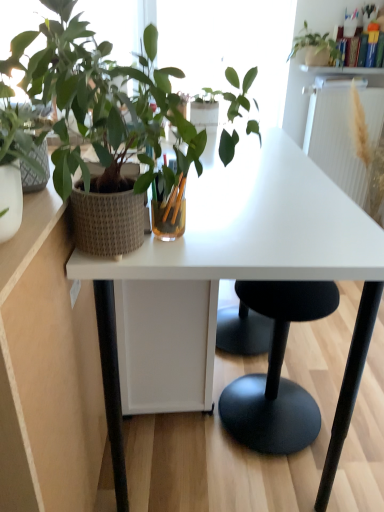
Question: Does textured woven pot at left, arranged as the 1th houseplant when viewed from the front, have a lesser height compared to white glossy shelf at upper center?

Choices:
 (A) no
 (B) yes

Answer: (A)

Question: From a real-world perspective, is textured woven pot at left, placed as the 1th houseplant when sorted from left to right, located higher than white glossy shelf at upper center?

Choices:
 (A) no
 (B) yes

Answer: (B)

Question: Does textured woven pot at left, the 1th houseplant when ordered from bottom to top, appear on the right side of white glossy shelf at upper center?

Choices:
 (A) no
 (B) yes

Answer: (A)

Question: Can you confirm if textured woven pot at left, the 1th houseplant when ordered from bottom to top, is wider than white glossy shelf at upper center?

Choices:
 (A) no
 (B) yes

Answer: (B)

Question: Is the depth of textured woven pot at left, the 1th houseplant when ordered from bottom to top, greater than that of white glossy shelf at upper center?

Choices:
 (A) yes
 (B) no

Answer: (B)

Question: Does textured woven pot at left, which is the 2th houseplant from right to left, have a smaller size compared to white glossy shelf at upper center?

Choices:
 (A) no
 (B) yes

Answer: (A)

Question: Is white textured radiator at upper right behind matte white pot at upper right, which is counted as the second houseplant, starting from the bottom?

Choices:
 (A) no
 (B) yes

Answer: (A)

Question: From a real-world perspective, is white textured radiator at upper right over matte white pot at upper right, marked as the 1th houseplant in a back-to-front arrangement?

Choices:
 (A) yes
 (B) no

Answer: (B)

Question: Does white textured radiator at upper right have a greater width compared to matte white pot at upper right, which ranks as the 2th houseplant in left-to-right order?

Choices:
 (A) no
 (B) yes

Answer: (B)

Question: Is white textured radiator at upper right outside of matte white pot at upper right, placed as the first houseplant when sorted from right to left?

Choices:
 (A) no
 (B) yes

Answer: (B)

Question: Does white textured radiator at upper right have a larger size compared to matte white pot at upper right, which ranks as the 2th houseplant in left-to-right order?

Choices:
 (A) yes
 (B) no

Answer: (A)

Question: From the image's perspective, is white textured radiator at upper right under matte white pot at upper right, which is counted as the second houseplant, starting from the bottom?

Choices:
 (A) no
 (B) yes

Answer: (B)

Question: Is white matte desk at center not inside white textured radiator at upper right?

Choices:
 (A) no
 (B) yes

Answer: (B)